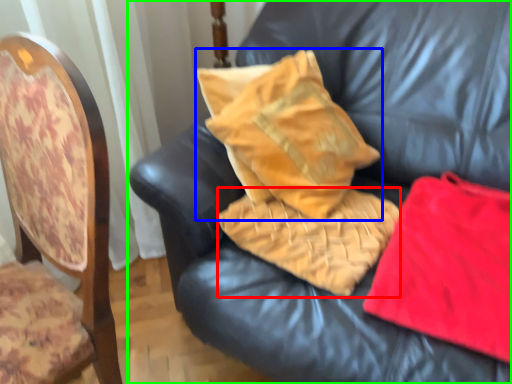
Question: Which is farther away from material (highlighted by a red box)? pillow (highlighted by a blue box) or furniture (highlighted by a green box)?

Choices:
 (A) pillow
 (B) furniture

Answer: (B)